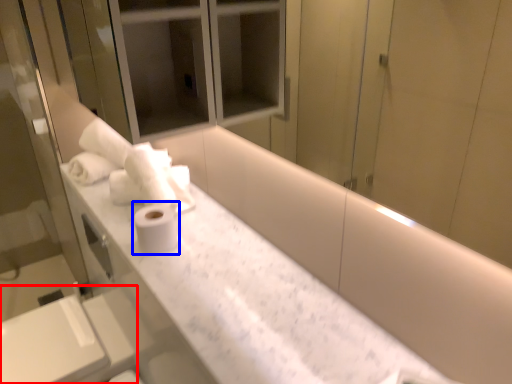
Question: Which point is closer to the camera, sink (highlighted by a red box) or toilet paper (highlighted by a blue box)?

Choices:
 (A) sink
 (B) toilet paper

Answer: (B)